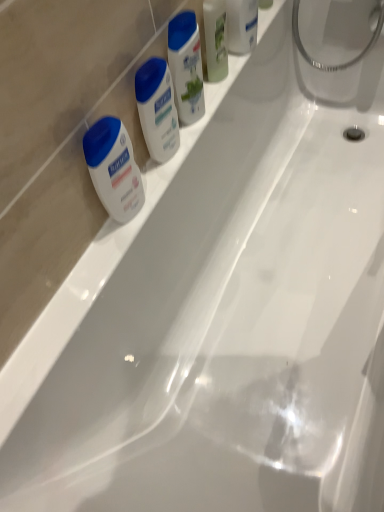
Identify the location of vacant space in front of white matte lotion at left. (94, 273).